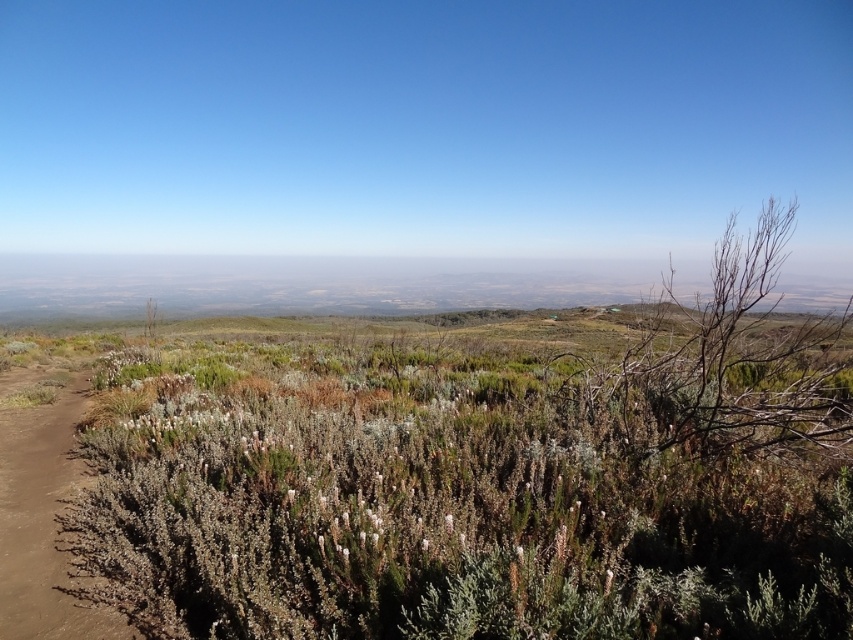
Is green shrubbery at center closer to the viewer compared to brown dirt path at lower left?

Yes, green shrubbery at center is in front of brown dirt path at lower left.

Is point (445, 372) in front of point (3, 408)?

No, it is behind (3, 408).

Find the location of `green shrubbery at center`. green shrubbery at center is located at coordinates (453, 502).